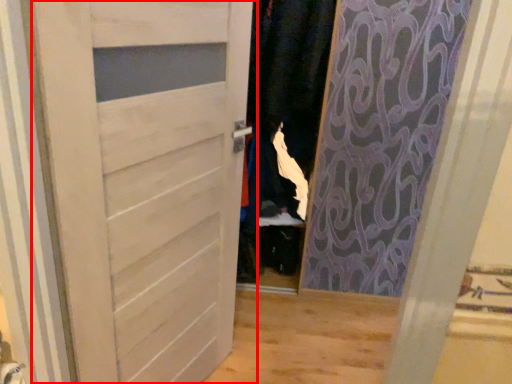
Question: In this image, where is door (annotated by the red box) located relative to clothing?

Choices:
 (A) left
 (B) right

Answer: (A)